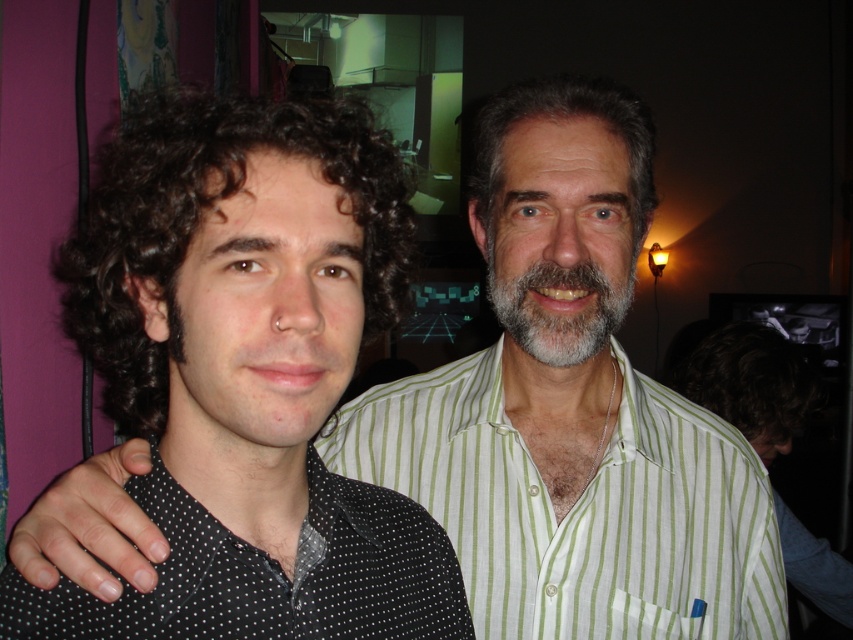
You are a photographer at a social event. You want to take a group photo of the dark curly hair at left and the person on the right. The minimum distance between subjects for your camera to focus properly is 35 centimeters. Can you capture them both in focus?

The dark curly hair at left and the person on the right are 40.08 centimeters apart, which exceeds the minimum required distance of 35 centimeters. Therefore, the camera can focus on both subjects.

You are a photographer at a social event. You need to capture a photo of the dark curly hair at left and gray matte hair at upper center. Based on their positions, which hair is lower in the frame?

The dark curly hair at left is positioned under the gray matte hair at upper center, so the dark curly hair at left is lower in the frame.

Consider the image. You are at a party and want to introduce yourself to both people with dark curly hair at left and dark curly hair at right. Which person has hair that is larger in size?

The dark curly hair at left is bigger than the dark curly hair at right, so the person on the left has larger hair.